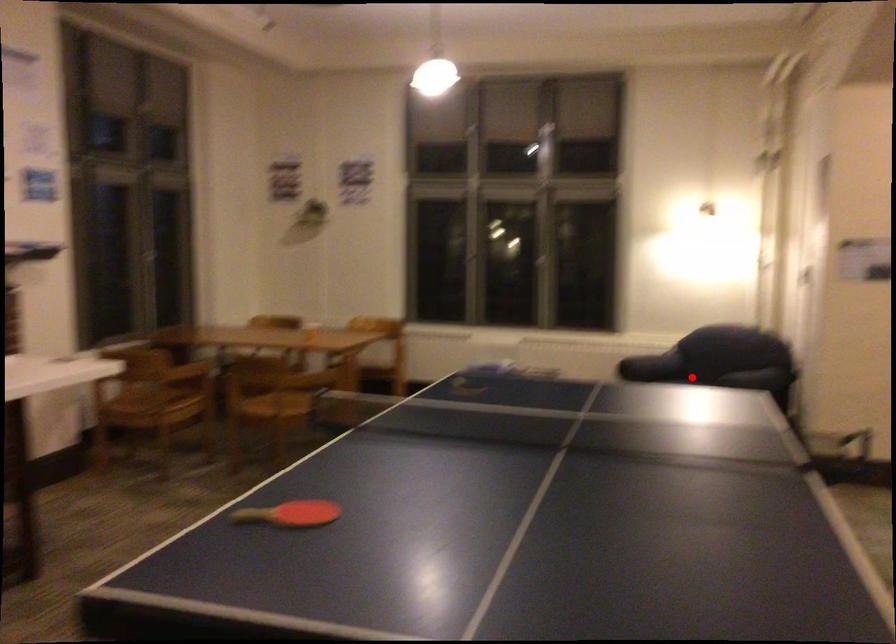
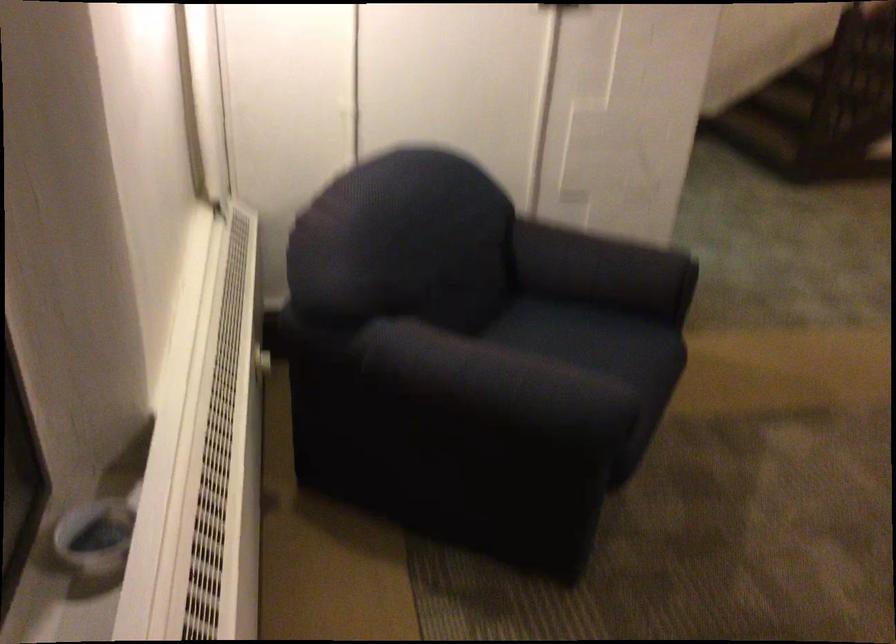
Question: I am providing you with two images of the same scene from different viewpoints. A red point is shown in image1. For the corresponding object point in image2, is it positioned nearer or farther from the camera?

Choices:
 (A) Nearer
 (B) Farther

Answer: (A)